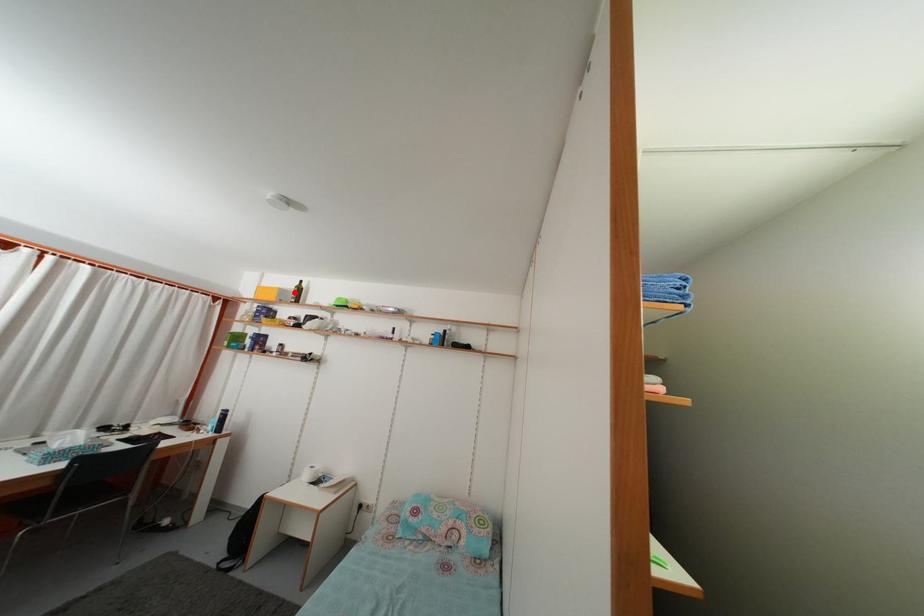
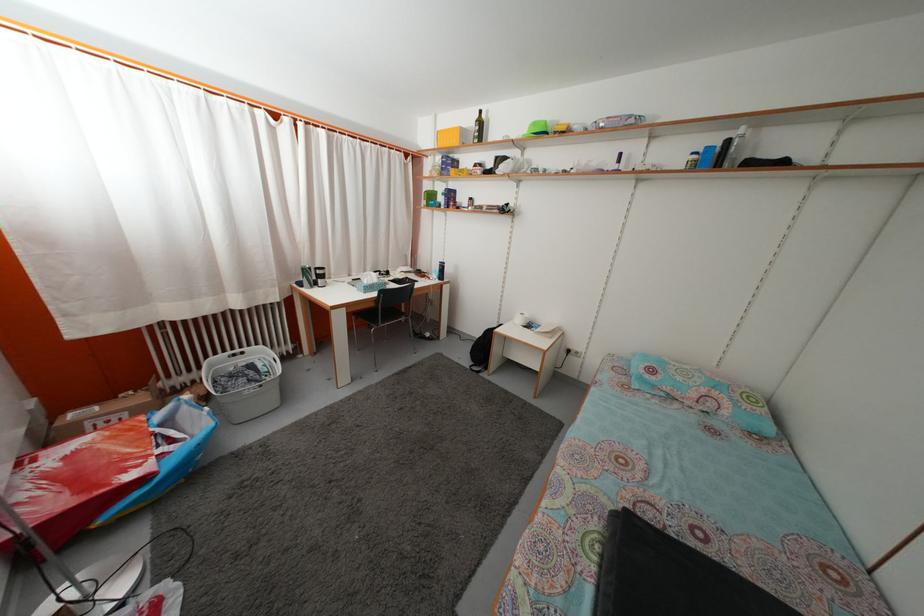
Where in the second image is the point corresponding to the highlighted location from the first image?

(475, 127)